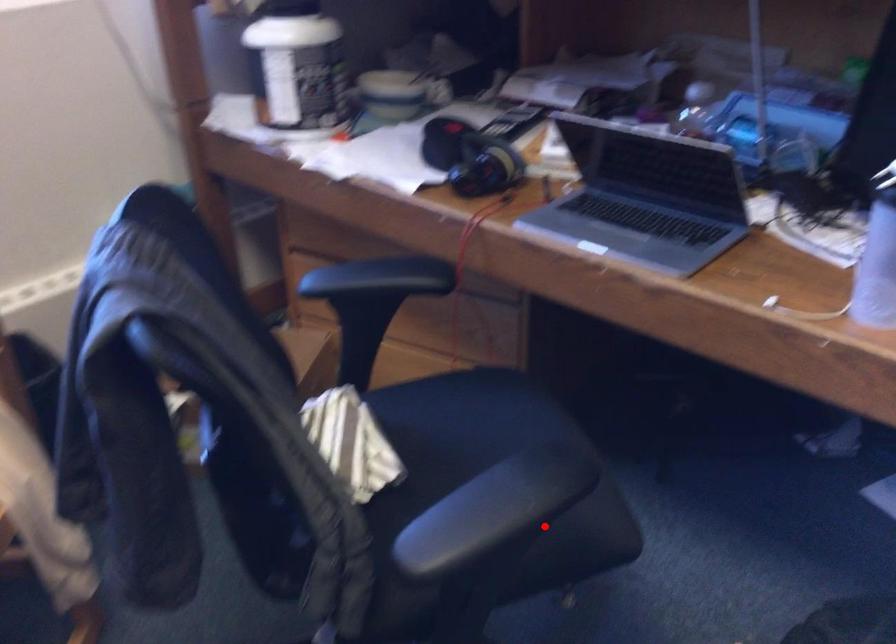
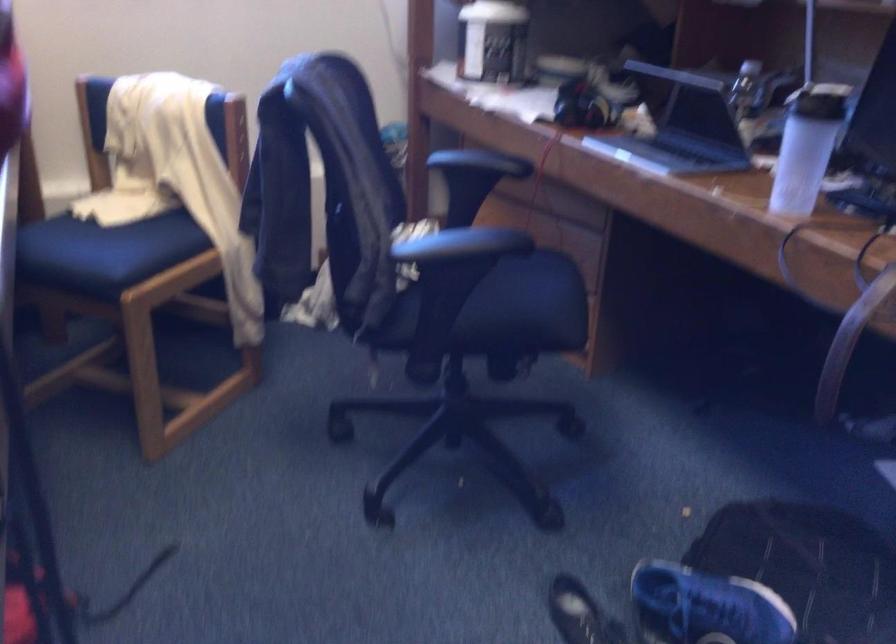
Where in the second image is the point corresponding to the highlighted location from the first image?

(515, 313)